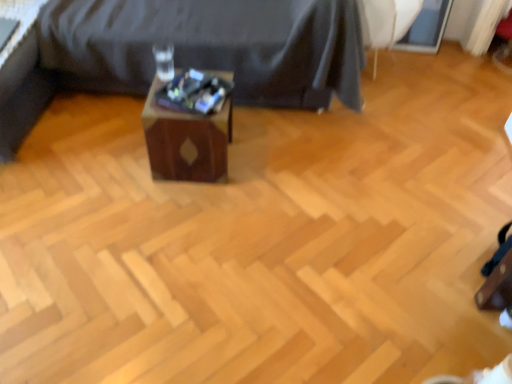
Question: In terms of size, does wooden side table at center appear bigger or smaller than white fabric swivel chair at upper right?

Choices:
 (A) small
 (B) big

Answer: (B)

Question: Is wooden side table at center situated inside white fabric swivel chair at upper right or outside?

Choices:
 (A) inside
 (B) outside

Answer: (B)

Question: Estimate the real-world distances between objects in this image. Which object is farther from the wooden box at center?

Choices:
 (A) white fabric swivel chair at upper right
 (B) wooden side table at center

Answer: (A)

Question: Which object is the closest to the wooden side table at center?

Choices:
 (A) white fabric swivel chair at upper right
 (B) wooden box at center

Answer: (B)